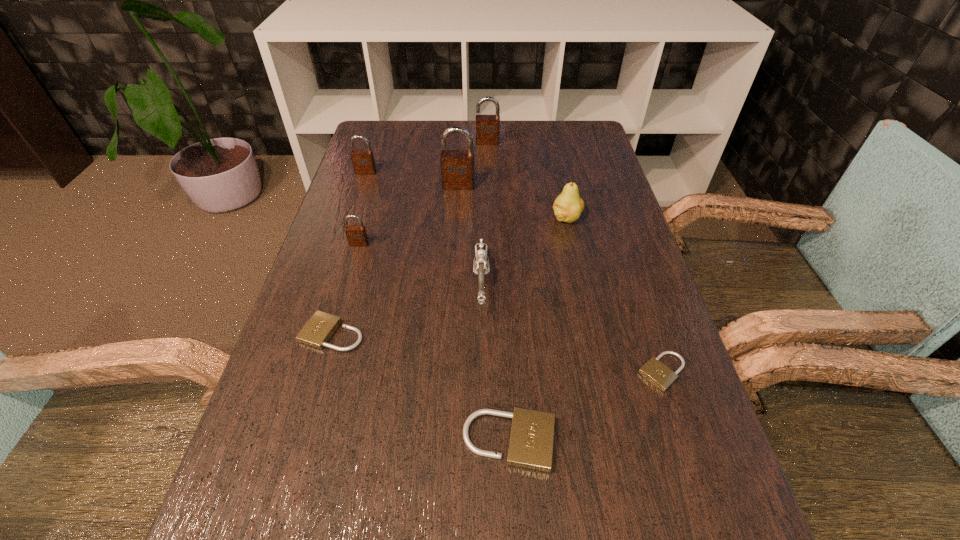
Locate an element on the screen. free region located on the front-facing side of the second farthest brown padlock is located at coordinates (359, 193).

I want to click on free space located on the front-facing side of the fourth tallest padlock, so click(x=326, y=358).

Find the location of a particular element. vacant area situated aimed along the barrel of the gun is located at coordinates (482, 381).

Find the location of a particular element. The height and width of the screenshot is (540, 960). free space located 0.240m on the right of the nearest beige padlock is located at coordinates (700, 441).

Where is `vacant area situated on the back of the second shortest object`? This screenshot has width=960, height=540. vacant area situated on the back of the second shortest object is located at coordinates (348, 281).

The width and height of the screenshot is (960, 540). What are the coordinates of `free location located 0.340m on the left of the rightmost object` in the screenshot? It's located at (457, 372).

Where is `object situated at the far edge`? Image resolution: width=960 pixels, height=540 pixels. object situated at the far edge is located at coordinates (x=487, y=126).

You are a GUI agent. You are given a task and a screenshot of the screen. Output one action in this format:
    pyautogui.click(x=<x>, y=<y>)
    Task: Click on the pear that is at the right edge
    Image resolution: width=960 pixels, height=540 pixels.
    Given the screenshot: What is the action you would take?
    pyautogui.click(x=568, y=206)

Image resolution: width=960 pixels, height=540 pixels. I want to click on padlock at the right edge, so click(654, 371).

Identify the location of vacant region at the far edge of the desktop. (430, 120).